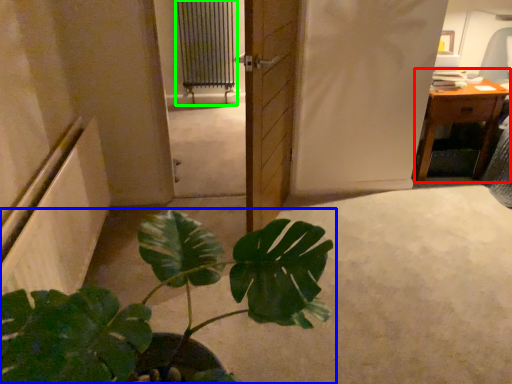
Question: Estimate the real-world distances between objects in this image. Which object is farther from table (highlighted by a red box), houseplant (highlighted by a blue box) or radiator (highlighted by a green box)?

Choices:
 (A) houseplant
 (B) radiator

Answer: (B)